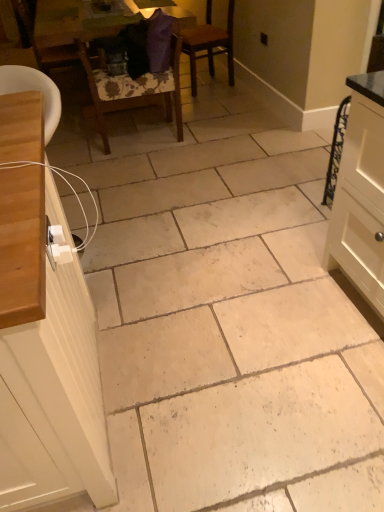
Question: Is brown wooden chair at center, which is the third chair from left to right, at the right side of wooden table at upper center?

Choices:
 (A) no
 (B) yes

Answer: (B)

Question: From a real-world perspective, is brown wooden chair at center, arranged as the first chair when viewed from the right, positioned over wooden table at upper center based on gravity?

Choices:
 (A) yes
 (B) no

Answer: (A)

Question: From the image's perspective, is brown wooden chair at center, arranged as the first chair when viewed from the right, located beneath wooden table at upper center?

Choices:
 (A) yes
 (B) no

Answer: (A)

Question: Can you confirm if brown wooden chair at center, which is the third chair from left to right, is taller than wooden table at upper center?

Choices:
 (A) yes
 (B) no

Answer: (A)

Question: Is brown wooden chair at center, arranged as the first chair when viewed from the right, placed right next to wooden table at upper center?

Choices:
 (A) yes
 (B) no

Answer: (B)

Question: Is brown wooden chair at center, which is the third chair from left to right, taller or shorter than wooden table at upper center?

Choices:
 (A) tall
 (B) short

Answer: (A)

Question: In terms of width, does brown wooden chair at center, which is the third chair from left to right, look wider or thinner when compared to wooden table at upper center?

Choices:
 (A) wide
 (B) thin

Answer: (B)

Question: In the image, is brown wooden chair at center, which is the third chair from left to right, positioned in front of or behind wooden table at upper center?

Choices:
 (A) front
 (B) behind

Answer: (B)

Question: From the image's perspective, is brown wooden chair at center, arranged as the first chair when viewed from the right, located above or below wooden table at upper center?

Choices:
 (A) below
 (B) above

Answer: (A)

Question: Is white matte cabinet at left in front of or behind wooden table at upper center in the image?

Choices:
 (A) front
 (B) behind

Answer: (A)

Question: Based on their positions, is white matte cabinet at left located to the left or right of wooden table at upper center?

Choices:
 (A) right
 (B) left

Answer: (A)

Question: Is white matte cabinet at left taller or shorter than wooden table at upper center?

Choices:
 (A) tall
 (B) short

Answer: (A)

Question: In terms of width, does white matte cabinet at left look wider or thinner when compared to wooden table at upper center?

Choices:
 (A) wide
 (B) thin

Answer: (B)

Question: From a real-world perspective, is wooden chair at left, which is the third chair in right-to-left order, positioned above or below brown wooden chair at center, arranged as the first chair when viewed from the right?

Choices:
 (A) below
 (B) above

Answer: (B)

Question: From the image's perspective, is wooden chair at left, which is the third chair in right-to-left order, located above or below brown wooden chair at center, arranged as the first chair when viewed from the right?

Choices:
 (A) below
 (B) above

Answer: (A)